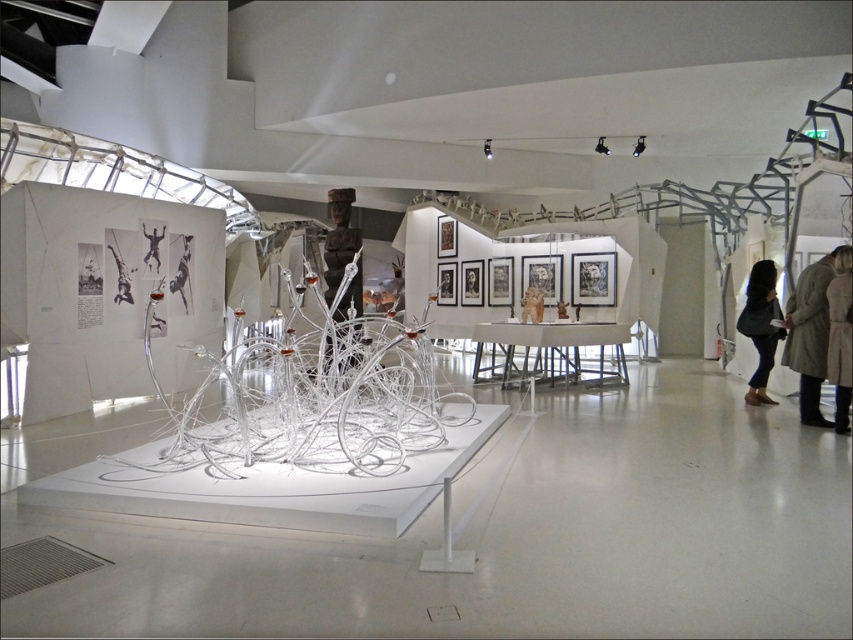
Which of these two, light beige coat at right or black leather bag at right, stands shorter?

black leather bag at right

Does light beige coat at right have a lesser width compared to black leather bag at right?

Indeed, light beige coat at right has a lesser width compared to black leather bag at right.

Between point (817, 280) and point (752, 340), which one is positioned behind?

The point (752, 340) is behind.

The height and width of the screenshot is (640, 853). In order to click on light beige coat at right in this screenshot , I will do `click(811, 332)`.

Is dark brown leather coat at lower right smaller than metallic figure at center?

Incorrect, dark brown leather coat at lower right is not smaller in size than metallic figure at center.

Is point (845, 284) behind point (148, 227)?

No, (845, 284) is in front of (148, 227).

What do you see at coordinates (840, 337) in the screenshot? I see `dark brown leather coat at lower right` at bounding box center [840, 337].

Locate an element on the screen. The width and height of the screenshot is (853, 640). dark brown leather coat at lower right is located at coordinates (840, 337).

Who is lower down, black leather bag at right or metallic figure at center?

Positioned lower is black leather bag at right.

Can you confirm if black leather bag at right is bigger than metallic figure at center?

Indeed, black leather bag at right has a larger size compared to metallic figure at center.

Which is in front, point (757, 260) or point (155, 257)?

Point (155, 257) is more forward.

Find the location of a particular element. The height and width of the screenshot is (640, 853). black leather bag at right is located at coordinates (761, 326).